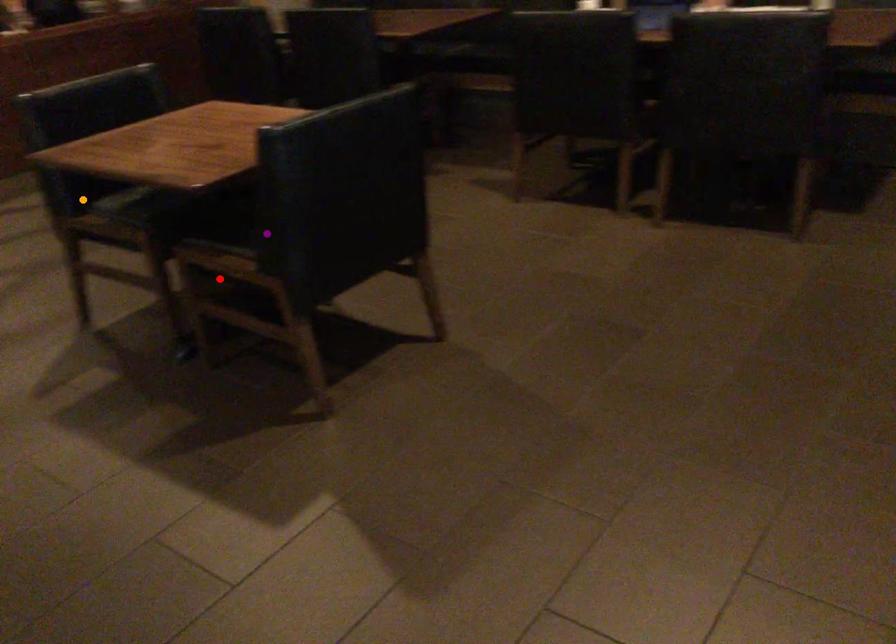
Order these from nearest to farthest:
- red point
- purple point
- orange point

purple point, red point, orange point